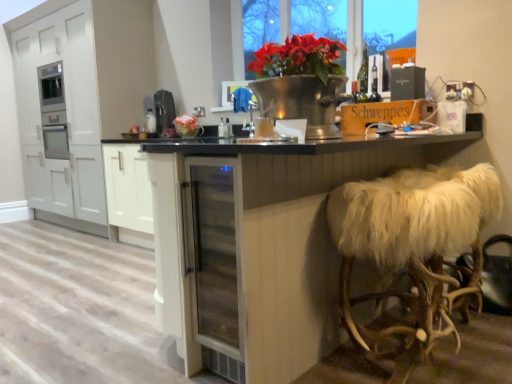
Question: Considering the relative sizes of red matte flower pot at upper center and black plastic coffee machine at center, which is the 2th appliance in right-to-left order, in the image provided, is red matte flower pot at upper center wider than black plastic coffee machine at center, which is the 2th appliance in right-to-left order,?

Choices:
 (A) yes
 (B) no

Answer: (B)

Question: Is black plastic coffee machine at center, which is the 2th appliance in right-to-left order, at the back of red matte flower pot at upper center?

Choices:
 (A) no
 (B) yes

Answer: (A)

Question: Considering the relative sizes of red matte flower pot at upper center and black plastic coffee machine at center, placed as the 1th appliance when sorted from left to right, in the image provided, is red matte flower pot at upper center thinner than black plastic coffee machine at center, placed as the 1th appliance when sorted from left to right,?

Choices:
 (A) no
 (B) yes

Answer: (B)

Question: Is the surface of red matte flower pot at upper center in direct contact with black plastic coffee machine at center, which is counted as the first appliance, starting from the back?

Choices:
 (A) no
 (B) yes

Answer: (A)

Question: Is red matte flower pot at upper center aimed at black plastic coffee machine at center, which is counted as the first appliance, starting from the back?

Choices:
 (A) yes
 (B) no

Answer: (B)

Question: From the image's perspective, is red matte flower pot at upper center located above or below matte black box at upper right, the second appliance viewed from the left?

Choices:
 (A) below
 (B) above

Answer: (B)

Question: Is red matte flower pot at upper center taller or shorter than matte black box at upper right, which is the first appliance from right to left?

Choices:
 (A) tall
 (B) short

Answer: (A)

Question: Does point (293, 8) appear closer or farther from the camera than point (401, 66)?

Choices:
 (A) closer
 (B) farther

Answer: (B)

Question: In the image, is red matte flower pot at upper center positioned in front of or behind matte black box at upper right, the second appliance viewed from the left?

Choices:
 (A) front
 (B) behind

Answer: (B)

Question: Is point (124, 99) closer or farther from the camera than point (394, 82)?

Choices:
 (A) farther
 (B) closer

Answer: (A)

Question: From a real-world perspective, is white matte cabinet at left above or below matte black box at upper right, the second appliance viewed from the left?

Choices:
 (A) below
 (B) above

Answer: (A)

Question: From the image's perspective, is white matte cabinet at left positioned above or below matte black box at upper right, which is the first appliance from right to left?

Choices:
 (A) below
 (B) above

Answer: (B)

Question: Is white matte cabinet at left taller or shorter than matte black box at upper right, which is the first appliance from right to left?

Choices:
 (A) tall
 (B) short

Answer: (A)

Question: In the image, is red matte flower pot at upper center positioned in front of or behind transparent glass table at center?

Choices:
 (A) behind
 (B) front

Answer: (A)

Question: From a real-world perspective, is red matte flower pot at upper center positioned above or below transparent glass table at center?

Choices:
 (A) above
 (B) below

Answer: (A)